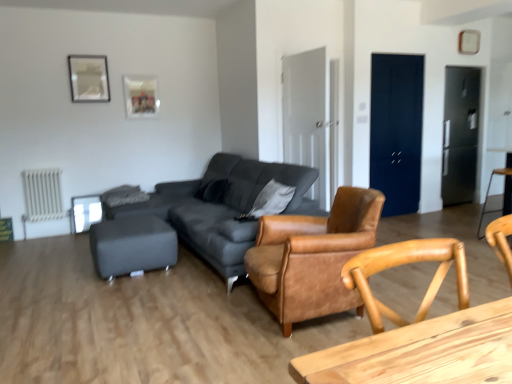
Question: Is point (95, 71) closer or farther from the camera than point (54, 168)?

Choices:
 (A) closer
 (B) farther

Answer: (B)

Question: In the image, is metallic silver picture frame at upper left, the second picture frame in the back-to-front sequence, positioned in front of or behind white metallic radiator at lower left?

Choices:
 (A) behind
 (B) front

Answer: (A)

Question: Considering the real-world distances, which object is closest to the metallic silver picture frame at upper left, the second picture frame in the back-to-front sequence?

Choices:
 (A) matte gray ottoman at lower left, acting as the 2th bar stool starting from the right
 (B) matte glass picture frame at upper center, marked as the 2th picture frame in a front-to-back arrangement
 (C) leather armchair at center
 (D) black fabric pillow at center
 (E) wooden table at lower right

Answer: (B)

Question: Which object is the farthest from the wooden bar stool at right, marked as the 2th bar stool in a left-to-right arrangement?

Choices:
 (A) white metallic radiator at lower left
 (B) matte glass picture frame at upper center, which is the 1th picture frame in back-to-front order
 (C) matte black couch at center
 (D) matte gray ottoman at lower left, acting as the 2th bar stool starting from the right
 (E) leather armchair at center

Answer: (A)